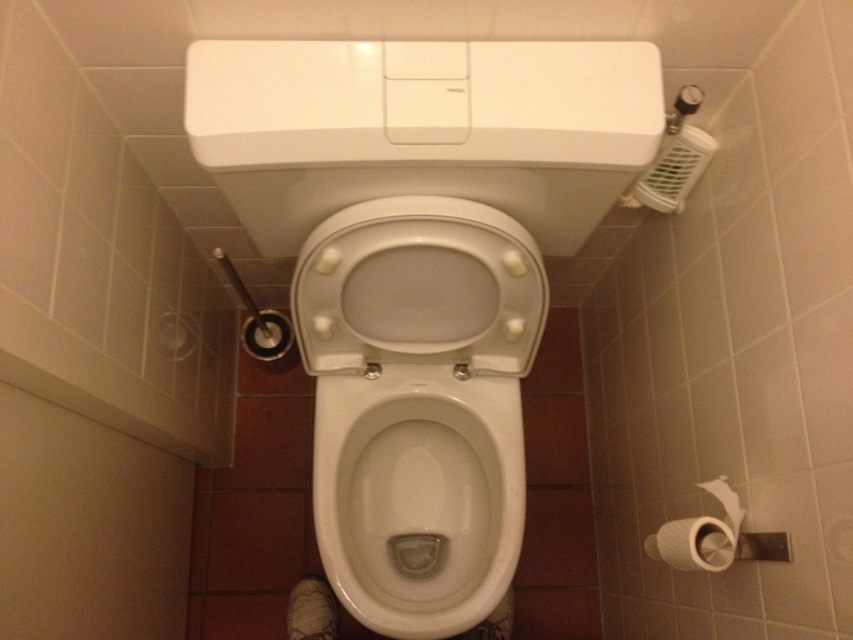
Question: Can you confirm if white glossy toilet bowl at center is smaller than white matte toilet paper at lower right?

Choices:
 (A) no
 (B) yes

Answer: (A)

Question: Which point is closer to the camera taking this photo?

Choices:
 (A) (369, 600)
 (B) (723, 477)

Answer: (B)

Question: Can you confirm if white glossy toilet bowl at center is positioned below white matte toilet paper at lower right?

Choices:
 (A) no
 (B) yes

Answer: (B)

Question: Among these points, which one is nearest to the camera?

Choices:
 (A) (728, 502)
 (B) (445, 566)

Answer: (A)

Question: Does white glossy toilet bowl at center come in front of white matte toilet paper at lower right?

Choices:
 (A) no
 (B) yes

Answer: (A)